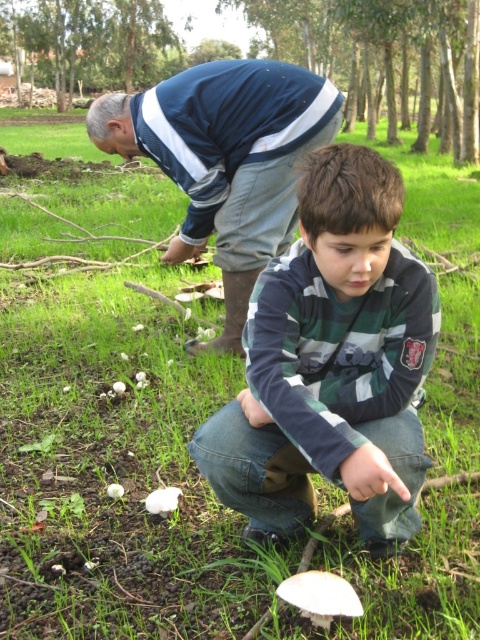
You are the young boy in the image. You want to hand a small object to the older man who is bent over behind you. To do this, you need to move the green striped sweater at center out of the way. Is the point where you need to move the green striped sweater at center located at coordinates point (332, 364)?

Yes, the point where the green striped sweater at center is located is at coordinates point (332, 364), so moving it from there would clear the path.

You are standing at the origin point and want to reach the green striped sweater at center. Which direction should you move in to get there?

The green striped sweater at center is located at point 0.569 in the x coordinate and 0.692 in the y coordinate. Since you are at the origin point, you should move towards the northeast direction to reach it.

You are a photographer trying to capture both the green striped sweater at center and the blue striped sweater at upper center in a single frame. Based on their positions, which sweater will appear larger in the photo?

The green striped sweater at center will appear larger in the photo because it is closer to the viewer than the blue striped sweater at upper center.